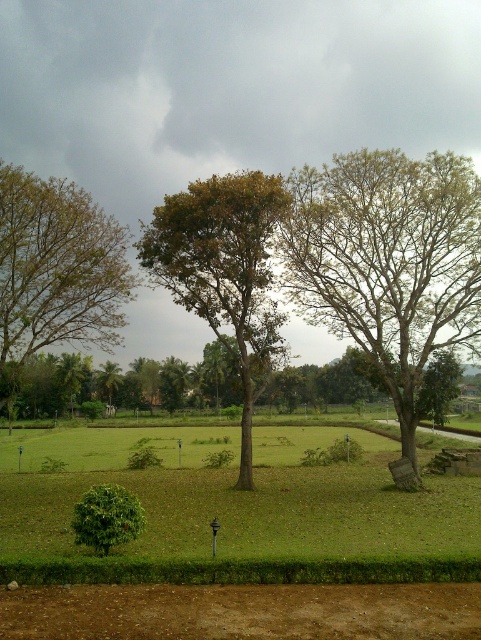
Which is more to the left, green leafy tree at right or brown leafy tree at upper left?

From the viewer's perspective, brown leafy tree at upper left appears more on the left side.

Which is behind, point (435, 154) or point (17, 362)?

Point (435, 154)

Locate an element on the screen. Image resolution: width=481 pixels, height=640 pixels. green leafy tree at right is located at coordinates (388, 266).

Between green leafy tree at right and green leafy tree at center, which one has less height?

Standing shorter between the two is green leafy tree at right.

The height and width of the screenshot is (640, 481). Describe the element at coordinates (388, 266) in the screenshot. I see `green leafy tree at right` at that location.

The height and width of the screenshot is (640, 481). Find the location of `green leafy tree at right`. green leafy tree at right is located at coordinates (388, 266).

Image resolution: width=481 pixels, height=640 pixels. What do you see at coordinates (224, 273) in the screenshot? I see `green leafy tree at center` at bounding box center [224, 273].

The width and height of the screenshot is (481, 640). Identify the location of green leafy tree at center. (224, 273).